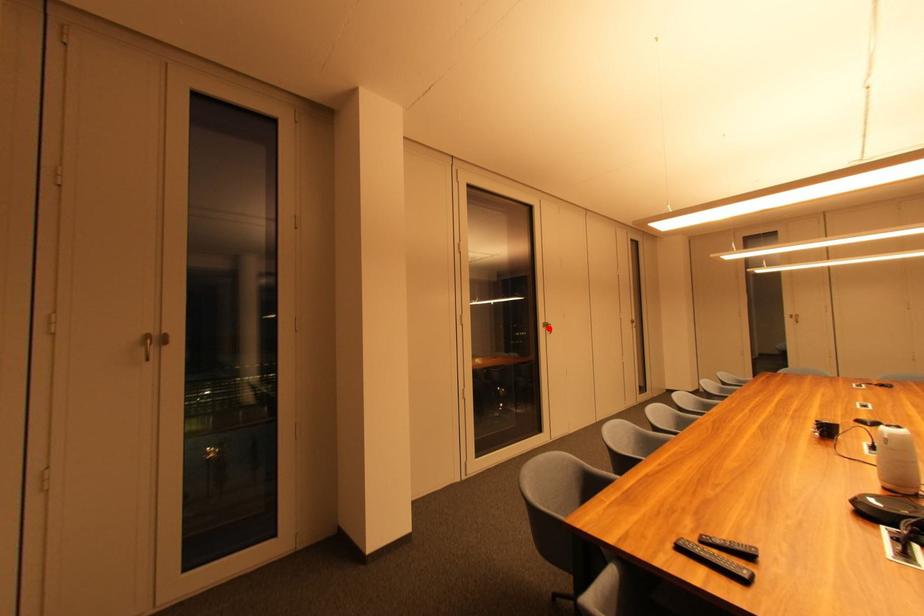
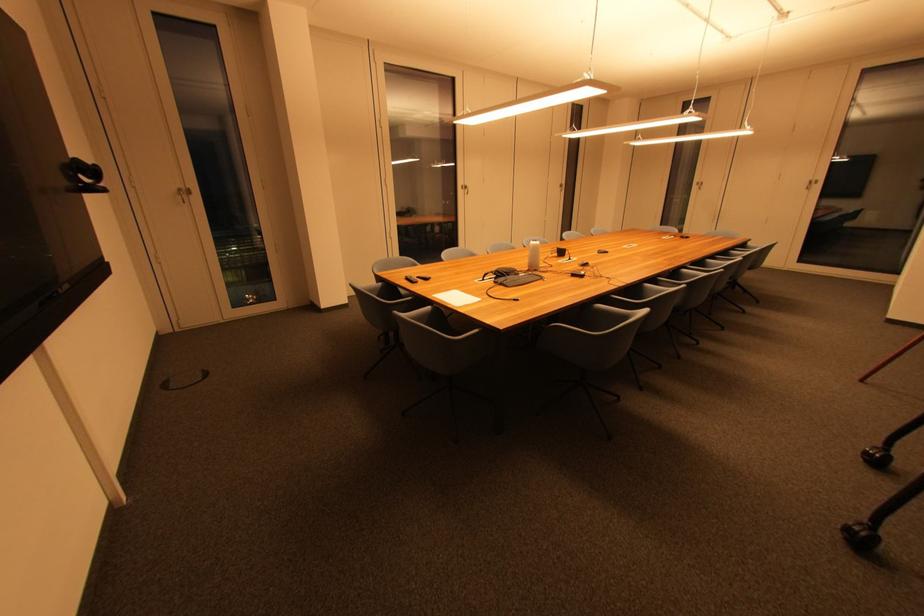
Question: I am providing you with two images of the same scene from different viewpoints. Image1 has a red point marked. In image2, the corresponding 3D location appears at what relative position? Reply with the corresponding letter.

Choices:
 (A) Closer
 (B) Farther

Answer: (A)